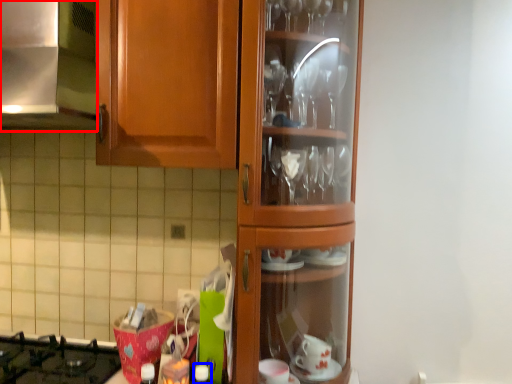
Question: Which of the following is the farthest to the observer, exhaust hood (highlighted by a red box) or bottle (highlighted by a blue box)?

Choices:
 (A) exhaust hood
 (B) bottle

Answer: (B)